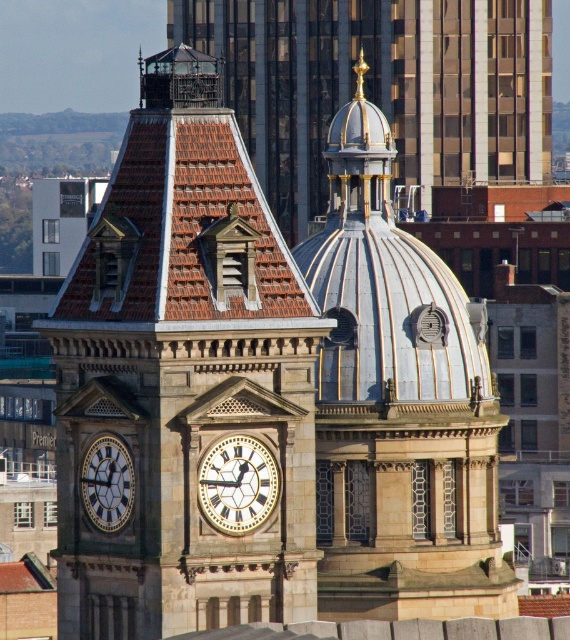
You are standing in front of the clock tower and notice two points marked on the tower. The first point is at coordinate point (431, 531) and the second is at point (246, 476). Which point is closer to your eyes?

Point (246, 476) is closer to your eyes because it is not as far away as point (431, 531), which is further away from you.